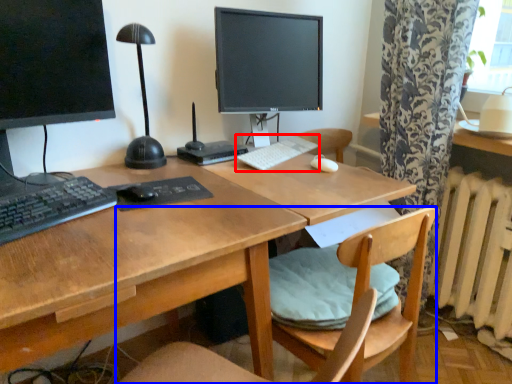
Question: Which object appears closest to the camera in this image, keyboard (highlighted by a red box) or chair (highlighted by a blue box)?

Choices:
 (A) keyboard
 (B) chair

Answer: (B)